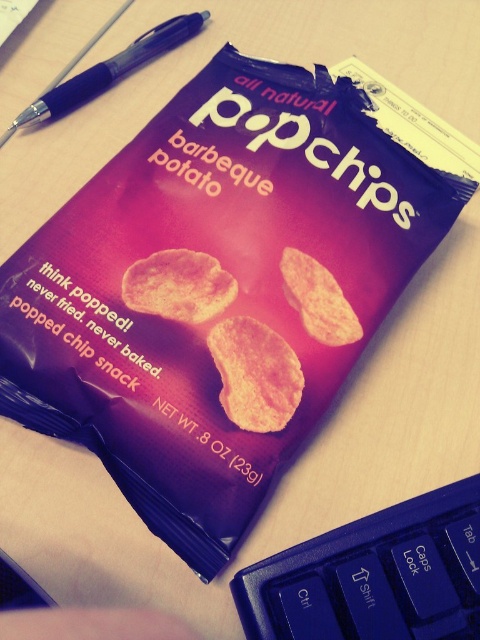
Between point (277, 429) and point (286, 291), which one is positioned in front?

Point (277, 429) is in front.

Can you confirm if yellow matte popchip at center is shorter than matte orange popchip at center?

No, yellow matte popchip at center is not shorter than matte orange popchip at center.

Which is in front, point (263, 352) or point (338, 340)?

Point (263, 352) is in front.

Where is `yellow matte popchip at center`? yellow matte popchip at center is located at coordinates (254, 372).

Does blue plastic keyboard at bottom right appear on the right side of matte orange chip at center?

Indeed, blue plastic keyboard at bottom right is positioned on the right side of matte orange chip at center.

Which of these two, blue plastic keyboard at bottom right or matte orange chip at center, stands shorter?

matte orange chip at center

Image resolution: width=480 pixels, height=640 pixels. I want to click on blue plastic keyboard at bottom right, so click(x=374, y=576).

Describe the element at coordinates (254, 372) in the screenshot. The image size is (480, 640). I see `yellow matte popchip at center` at that location.

Can you confirm if yellow matte popchip at center is taller than matte orange chip at center?

Correct, yellow matte popchip at center is much taller as matte orange chip at center.

What do you see at coordinates (254, 372) in the screenshot?
I see `yellow matte popchip at center` at bounding box center [254, 372].

At what (x,y) coordinates should I click in order to perform the action: click on yellow matte popchip at center. Please return your answer as a coordinate pair (x, y). The image size is (480, 640). Looking at the image, I should click on (254, 372).